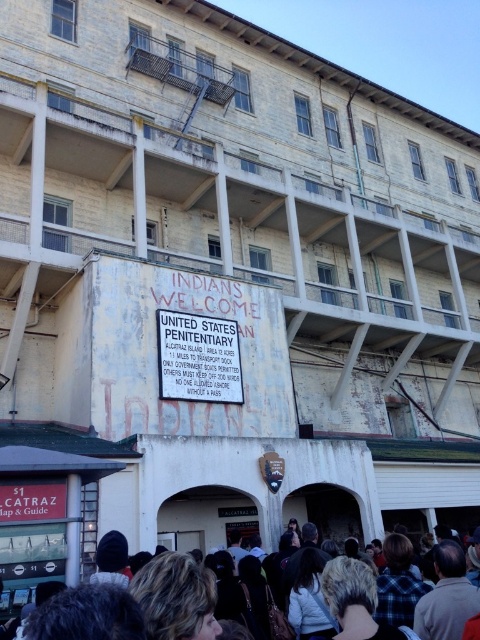
Question: Which point appears closest to the camera in this image?

Choices:
 (A) (467, 579)
 (B) (214, 385)

Answer: (A)

Question: Which of the following is the farthest from the observer?

Choices:
 (A) white paper sign at center
 (B) dark hair at lower center

Answer: (A)

Question: Does dark hair at lower center have a greater width compared to white paper sign at center?

Choices:
 (A) yes
 (B) no

Answer: (A)

Question: Is dark hair at lower center bigger than white paper sign at center?

Choices:
 (A) no
 (B) yes

Answer: (B)

Question: Is dark hair at lower center below white paper sign at center?

Choices:
 (A) yes
 (B) no

Answer: (A)